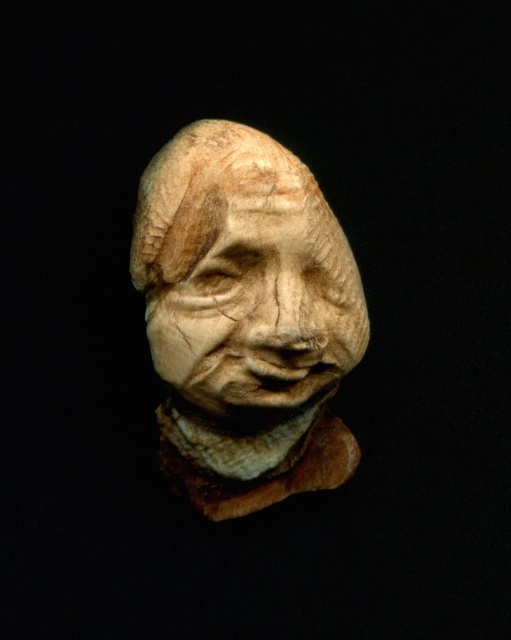
Which is in front, point (180, 260) or point (287, 324)?

Point (287, 324) is in front.

The height and width of the screenshot is (640, 511). In order to click on matte beige stone head at center in this screenshot , I will do `click(245, 317)`.

What do you see at coordinates (245, 317) in the screenshot?
I see `matte beige stone head at center` at bounding box center [245, 317].

Where is `matte beige stone head at center`? matte beige stone head at center is located at coordinates (245, 317).